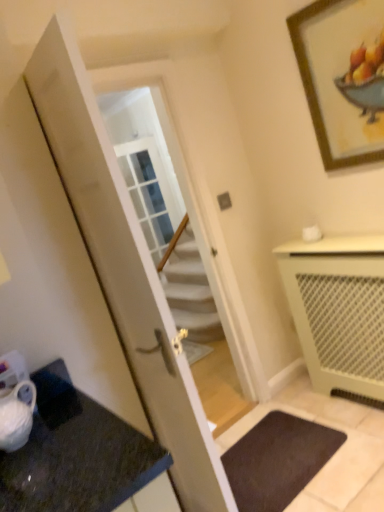
Question: Is the depth of beige mesh radiator at lower right less than that of white glossy door at center?

Choices:
 (A) no
 (B) yes

Answer: (A)

Question: Is beige mesh radiator at lower right to the right of white glossy door at center from the viewer's perspective?

Choices:
 (A) no
 (B) yes

Answer: (B)

Question: Is beige mesh radiator at lower right to the left of white glossy door at center from the viewer's perspective?

Choices:
 (A) no
 (B) yes

Answer: (A)

Question: Is beige mesh radiator at lower right completely or partially outside of white glossy door at center?

Choices:
 (A) yes
 (B) no

Answer: (A)

Question: Does beige mesh radiator at lower right have a smaller size compared to white glossy door at center?

Choices:
 (A) no
 (B) yes

Answer: (B)

Question: Does beige mesh radiator at lower right have a greater width compared to white glossy door at center?

Choices:
 (A) no
 (B) yes

Answer: (B)

Question: Is white glossy door at center smaller than wooden framed artwork at upper right?

Choices:
 (A) no
 (B) yes

Answer: (A)

Question: Is white glossy door at center closer to the viewer compared to wooden framed artwork at upper right?

Choices:
 (A) yes
 (B) no

Answer: (A)

Question: Can you confirm if white glossy door at center is taller than wooden framed artwork at upper right?

Choices:
 (A) no
 (B) yes

Answer: (B)

Question: From the image's perspective, does white glossy door at center appear lower than wooden framed artwork at upper right?

Choices:
 (A) yes
 (B) no

Answer: (A)

Question: Would you say white glossy door at center contains wooden framed artwork at upper right?

Choices:
 (A) no
 (B) yes

Answer: (A)

Question: Is white glossy door at center placed right next to wooden framed artwork at upper right?

Choices:
 (A) no
 (B) yes

Answer: (A)

Question: Is dark brown carpet at lower center facing towards white glossy door at center?

Choices:
 (A) no
 (B) yes

Answer: (A)